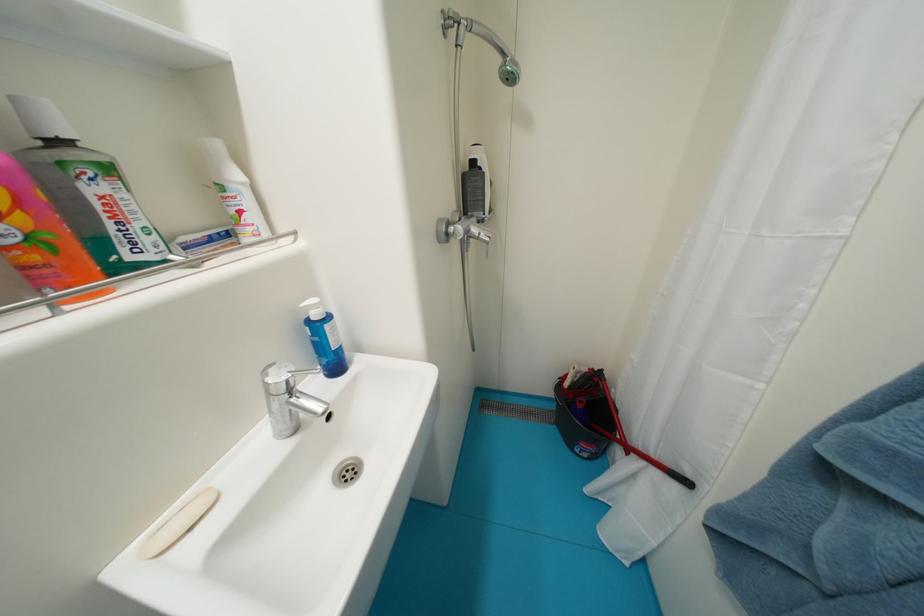
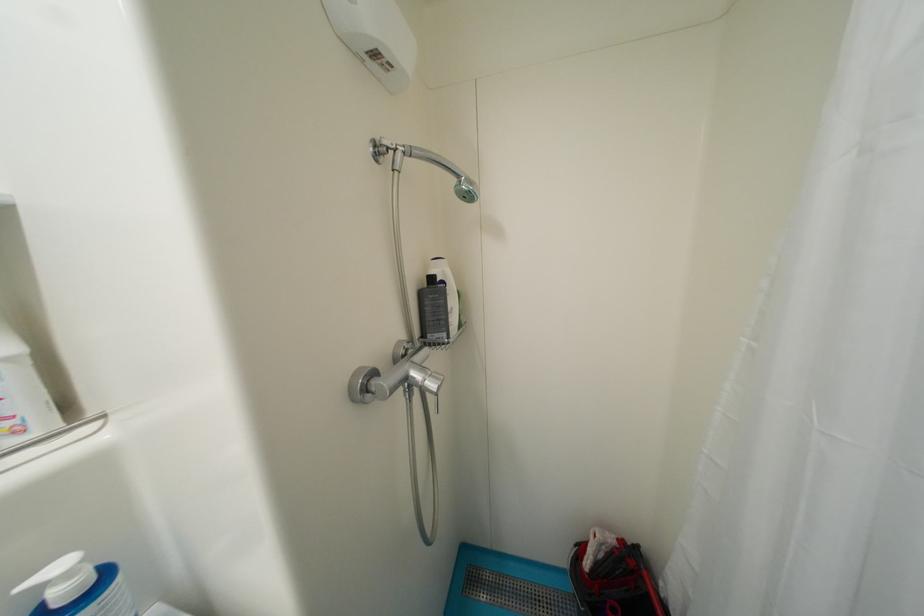
The point at (454,229) is marked in the first image. Where is the corresponding point in the second image?

(374, 383)